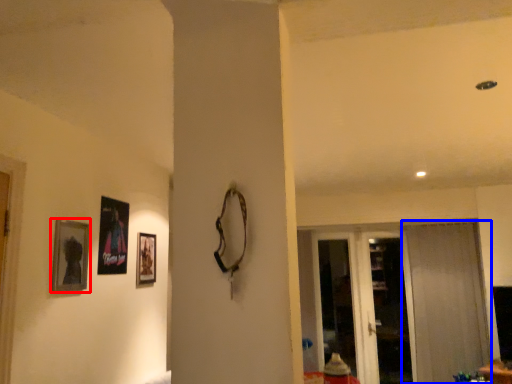
Question: Which object is closer to the camera taking this photo, picture frame (highlighted by a red box) or curtain (highlighted by a blue box)?

Choices:
 (A) picture frame
 (B) curtain

Answer: (A)